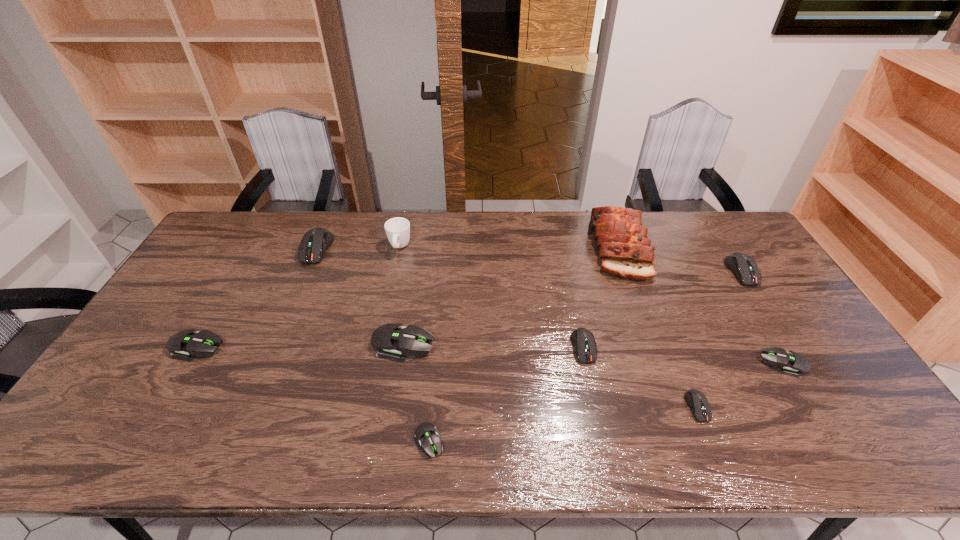
I want to click on vacant space situated on the button of the third dark computer equipment from right to left, so click(597, 413).

The height and width of the screenshot is (540, 960). I want to click on vacant area located 0.160m on the front of the leftmost gray computer mouse, so click(x=156, y=416).

Find the location of a particular element. vacant space positioned on the left of the rightmost gray computer mouse is located at coordinates (676, 364).

Locate an element on the screen. vacant area situated on the left of the smallest gray computer mouse is located at coordinates (378, 442).

Locate an element on the screen. This screenshot has height=540, width=960. bread that is at the far edge is located at coordinates (624, 250).

Where is `cup that is at the far edge`? cup that is at the far edge is located at coordinates (397, 229).

In order to click on computer equipment situated at the far edge in this screenshot , I will do `click(315, 242)`.

Identify the location of object that is at the left edge. This screenshot has width=960, height=540. (192, 343).

The image size is (960, 540). I want to click on vacant area at the far edge, so click(x=523, y=236).

Find the location of `vacant area at the near edge of the desktop`. vacant area at the near edge of the desktop is located at coordinates 383,435.